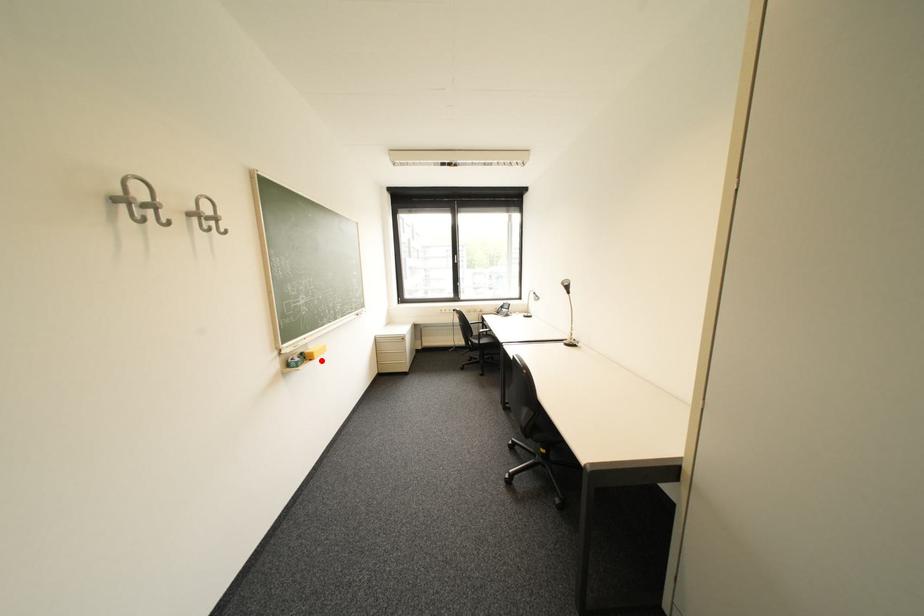
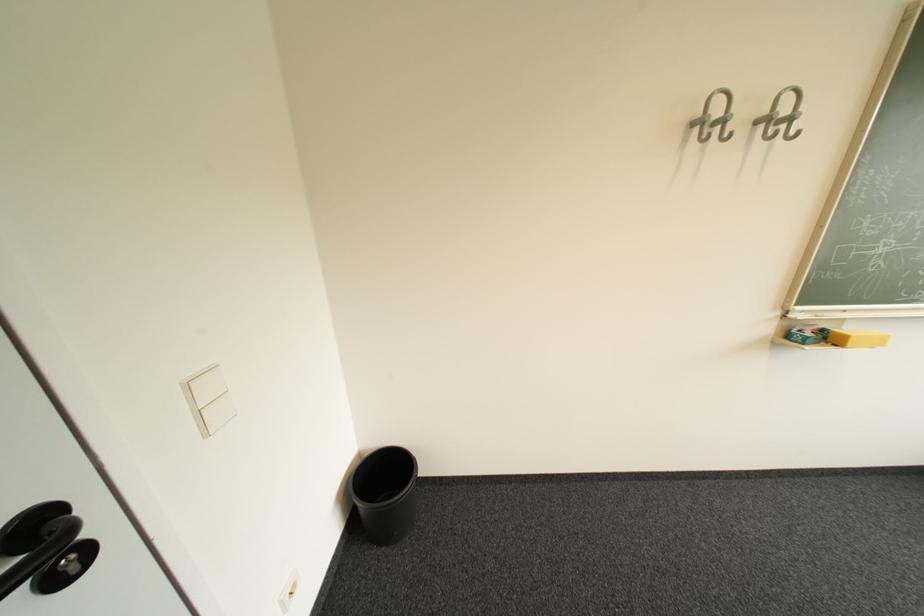
Find the pixel in the second image that matches the highlighted location in the first image.

(846, 346)